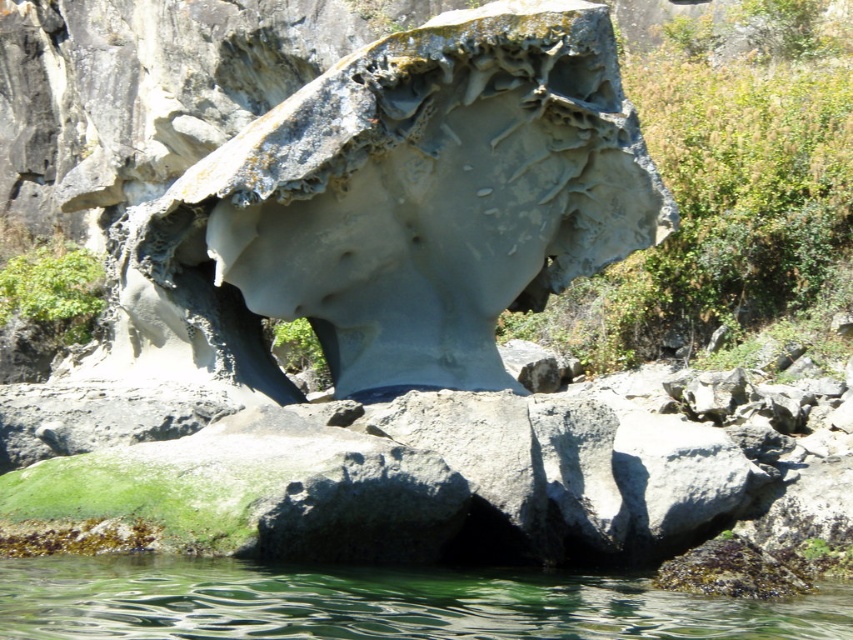
Between gray stone sculpture at center and clear water at lower center, which one appears on the left side from the viewer's perspective?

Positioned to the left is gray stone sculpture at center.

Does point (671, 204) come in front of point (347, 609)?

No, it is behind (347, 609).

Identify the location of gray stone sculpture at center. (408, 204).